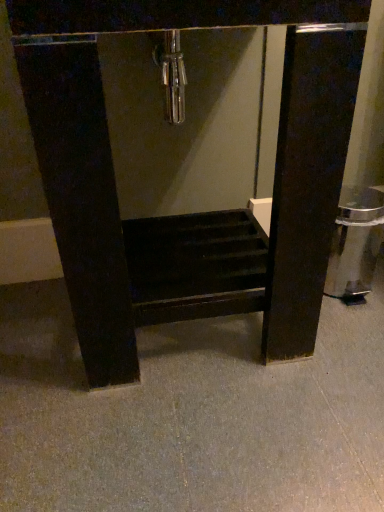
Locate an element on the screen. Image resolution: width=384 pixels, height=512 pixels. vacant area that is in front of matte black shelf at center is located at coordinates (x=200, y=431).